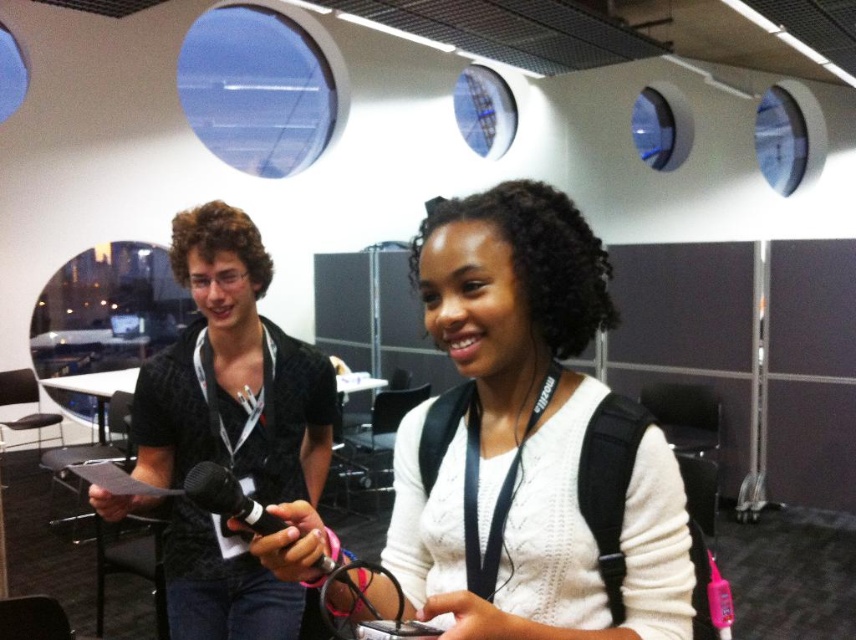
Question: Among these points, which one is farthest from the camera?

Choices:
 (A) (269, 374)
 (B) (497, 472)

Answer: (A)

Question: Can you confirm if white knitted sweater at center is smaller than black textured shirt at left?

Choices:
 (A) no
 (B) yes

Answer: (B)

Question: Does white knitted sweater at center have a smaller size compared to black textured shirt at left?

Choices:
 (A) no
 (B) yes

Answer: (B)

Question: Among these points, which one is nearest to the camera?

Choices:
 (A) (480, 445)
 (B) (281, 442)

Answer: (A)

Question: Is white knitted sweater at center to the left of black textured shirt at left from the viewer's perspective?

Choices:
 (A) yes
 (B) no

Answer: (B)

Question: Which object appears farthest from the camera in this image?

Choices:
 (A) white knitted sweater at center
 (B) black textured shirt at left

Answer: (B)